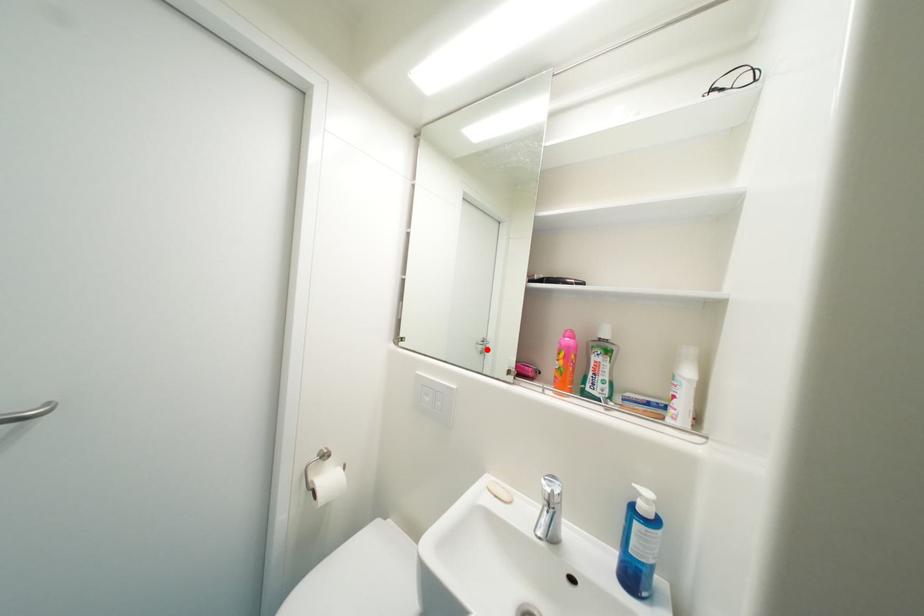
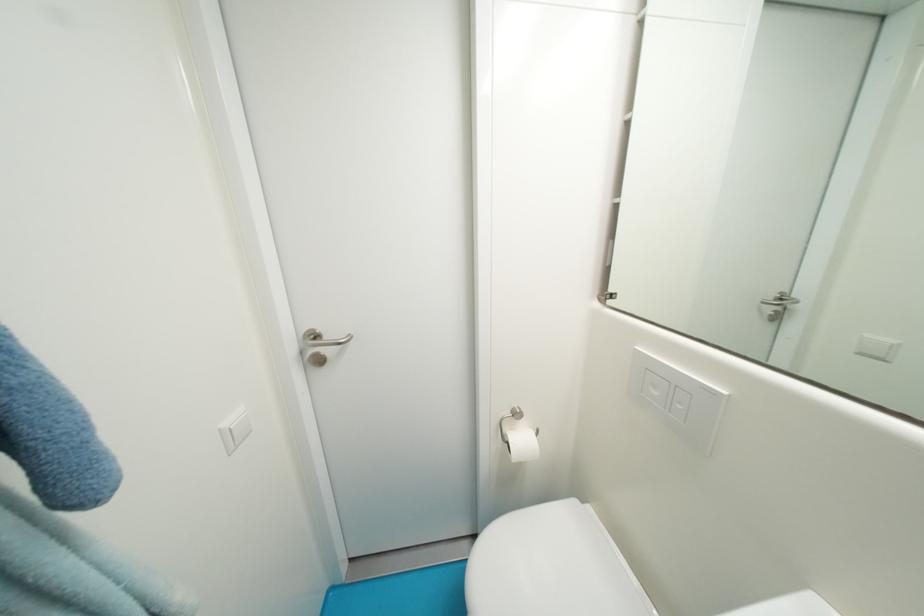
The point at the highlighted location is marked in the first image. Where is the corresponding point in the second image?

(777, 312)